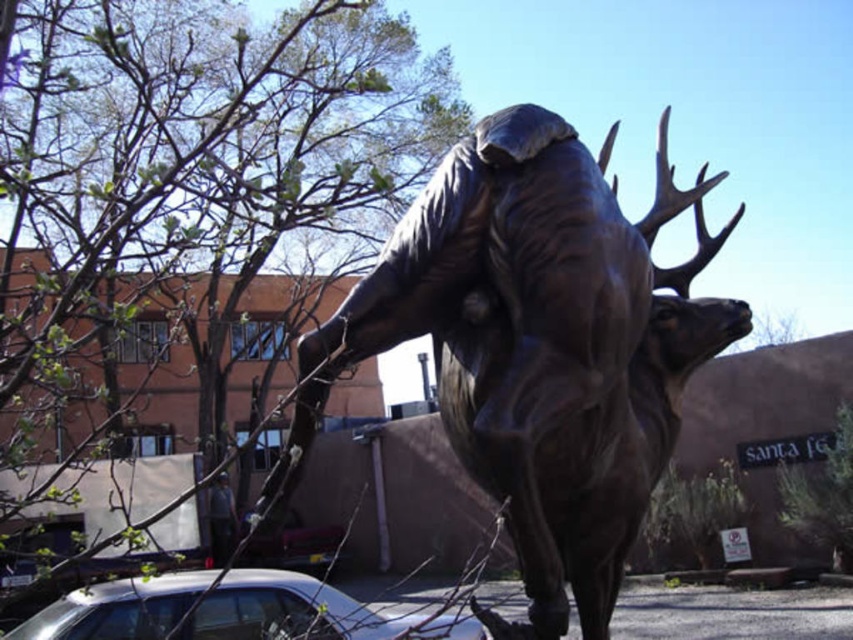
You are a photographer setting up a shot of the bronze statue at center and the dark gray fabric at lower left. Which object should you focus on first if you want to capture both in a single frame without moving your camera? Explain your reasoning based on their sizes.

The bronze statue at center is bigger than the dark gray fabric at lower left. Therefore, you should focus on the bronze statue at center first since it is larger and will require more attention in the composition to ensure it is properly framed and in focus.

You are a photographer setting up a shot of the bronze sculpture of two elk. You want to ensure the silver metallic car at lower left and the dark gray fabric at lower left are both in the frame. Which object should you position closer to the camera to include both in the shot?

The silver metallic car at lower left is positioned over dark gray fabric at lower left. To include both in the frame, position the silver metallic car at lower left closer to the camera since it is already above the dark gray fabric at lower left.

You are a photographer standing in front of the bronze sculpture of two elk. You notice a silver metallic car at lower left and a dark gray fabric at lower left. Which object is taller?

The silver metallic car at lower left is taller than the dark gray fabric at lower left.